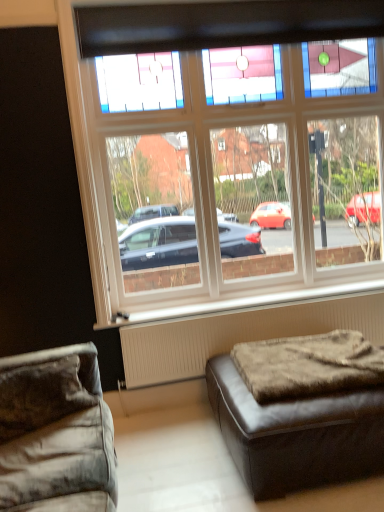
In order to face white textured radiator at lower right, should I rotate leftwards or rightwards?

Rotate your view right by about 9.620°.

This screenshot has width=384, height=512. What are the coordinates of `velvet fabric studio couch at lower left, which is the second studio couch from right to left` in the screenshot? It's located at (56, 433).

What is the approximate width of velvet fabric studio couch at lower left, which is the 1th studio couch in left-to-right order?

26.71 inches.

What do you see at coordinates (223, 170) in the screenshot?
I see `clear glass window at upper center` at bounding box center [223, 170].

Describe the element at coordinates (300, 410) in the screenshot. I see `brown leather ottoman at lower right, the 2th studio couch in the left-to-right sequence` at that location.

The image size is (384, 512). I want to click on brown fuzzy ottoman at lower right, so click(308, 365).

Which of these two, brown fuzzy ottoman at lower right or brown leather ottoman at lower right, which ranks as the first studio couch in right-to-left order, is smaller?

With smaller size is brown fuzzy ottoman at lower right.

Is brown fuzzy ottoman at lower right positioned beyond the bounds of brown leather ottoman at lower right, the 2th studio couch in the left-to-right sequence?

Indeed, brown fuzzy ottoman at lower right is completely outside brown leather ottoman at lower right, the 2th studio couch in the left-to-right sequence.

Is brown fuzzy ottoman at lower right taller or shorter than brown leather ottoman at lower right, the 2th studio couch in the left-to-right sequence?

brown fuzzy ottoman at lower right is shorter than brown leather ottoman at lower right, the 2th studio couch in the left-to-right sequence.

Can you confirm if brown fuzzy ottoman at lower right is positioned to the left of brown leather ottoman at lower right, which ranks as the first studio couch in right-to-left order?

Correct, you'll find brown fuzzy ottoman at lower right to the left of brown leather ottoman at lower right, which ranks as the first studio couch in right-to-left order.

Considering their positions, is clear glass window at upper center located in front of or behind white textured radiator at lower right?

clear glass window at upper center is positioned closer to the viewer than white textured radiator at lower right.

Between clear glass window at upper center and white textured radiator at lower right, which one has smaller size?

white textured radiator at lower right.

Locate an element on the screen. The width and height of the screenshot is (384, 512). window located in front of the white textured radiator at lower right is located at coordinates (223, 170).

Is clear glass window at upper center next to white textured radiator at lower right?

No, clear glass window at upper center is not making contact with white textured radiator at lower right.

Between brown leather ottoman at lower right, which ranks as the first studio couch in right-to-left order, and white textured radiator at lower right, which one has larger size?

brown leather ottoman at lower right, which ranks as the first studio couch in right-to-left order, is bigger.

Is brown leather ottoman at lower right, the 2th studio couch in the left-to-right sequence, at the right side of white textured radiator at lower right?

Indeed, brown leather ottoman at lower right, the 2th studio couch in the left-to-right sequence, is positioned on the right side of white textured radiator at lower right.

Does brown leather ottoman at lower right, which ranks as the first studio couch in right-to-left order, have a greater height compared to white textured radiator at lower right?

No, brown leather ottoman at lower right, which ranks as the first studio couch in right-to-left order, is not taller than white textured radiator at lower right.

Which object is closer to the camera, brown leather ottoman at lower right, the 2th studio couch in the left-to-right sequence, or white textured radiator at lower right?

Positioned in front is brown leather ottoman at lower right, the 2th studio couch in the left-to-right sequence.

Is white textured radiator at lower right touching clear glass window at upper center?

white textured radiator at lower right and clear glass window at upper center are not in contact.

Consider the image. How far apart are white textured radiator at lower right and clear glass window at upper center?

They are 74.78 centimeters apart.

Is white textured radiator at lower right smaller than clear glass window at upper center?

Yes, white textured radiator at lower right is smaller than clear glass window at upper center.

Does white textured radiator at lower right have a lesser height compared to clear glass window at upper center?

Yes, white textured radiator at lower right is shorter than clear glass window at upper center.

Which is in front, velvet fabric studio couch at lower left, which is the 1th studio couch in left-to-right order, or white textured radiator at lower right?

velvet fabric studio couch at lower left, which is the 1th studio couch in left-to-right order, is more forward.

How much distance is there between velvet fabric studio couch at lower left, which is the second studio couch from right to left, and white textured radiator at lower right?

38.16 inches.

From a real-world perspective, is velvet fabric studio couch at lower left, which is the second studio couch from right to left, physically located above or below white textured radiator at lower right?

velvet fabric studio couch at lower left, which is the second studio couch from right to left, is above white textured radiator at lower right.

Are brown leather ottoman at lower right, which ranks as the first studio couch in right-to-left order, and velvet fabric studio couch at lower left, which is the second studio couch from right to left, located far from each other?

→ brown leather ottoman at lower right, which ranks as the first studio couch in right-to-left order, is actually quite close to velvet fabric studio couch at lower left, which is the second studio couch from right to left.

Considering the sizes of objects brown leather ottoman at lower right, which ranks as the first studio couch in right-to-left order, and velvet fabric studio couch at lower left, which is the second studio couch from right to left, in the image provided, who is shorter, brown leather ottoman at lower right, which ranks as the first studio couch in right-to-left order, or velvet fabric studio couch at lower left, which is the second studio couch from right to left,?

brown leather ottoman at lower right, which ranks as the first studio couch in right-to-left order.

Image resolution: width=384 pixels, height=512 pixels. Identify the location of studio couch below the brown leather ottoman at lower right, the 2th studio couch in the left-to-right sequence (from the image's perspective). (56, 433).

Is brown leather ottoman at lower right, which ranks as the first studio couch in right-to-left order, bigger than velvet fabric studio couch at lower left, which is the 1th studio couch in left-to-right order?

Actually, brown leather ottoman at lower right, which ranks as the first studio couch in right-to-left order, might be smaller than velvet fabric studio couch at lower left, which is the 1th studio couch in left-to-right order.

From a real-world perspective, which object stands above the other?

brown fuzzy ottoman at lower right is physically above.

Is velvet fabric studio couch at lower left, which is the second studio couch from right to left, surrounding brown fuzzy ottoman at lower right?

No, velvet fabric studio couch at lower left, which is the second studio couch from right to left, does not contain brown fuzzy ottoman at lower right.

From the image's perspective, is velvet fabric studio couch at lower left, which is the 1th studio couch in left-to-right order, located above or below brown fuzzy ottoman at lower right?

From the image's perspective, velvet fabric studio couch at lower left, which is the 1th studio couch in left-to-right order, appears below brown fuzzy ottoman at lower right.

Which is in front, point (74, 487) or point (242, 355)?

Point (74, 487)

The width and height of the screenshot is (384, 512). Identify the location of the 1st studio couch positioned below the brown fuzzy ottoman at lower right (from the image's perspective). (300, 410).

Identify the location of window above the white textured radiator at lower right (from the image's perspective). (223, 170).

Which object lies further to the anchor point brown fuzzy ottoman at lower right, brown leather ottoman at lower right, which ranks as the first studio couch in right-to-left order, or white textured radiator at lower right?

Among the two, white textured radiator at lower right is located further to brown fuzzy ottoman at lower right.

Based on their spatial positions, is brown fuzzy ottoman at lower right or velvet fabric studio couch at lower left, which is the second studio couch from right to left, further from brown leather ottoman at lower right, the 2th studio couch in the left-to-right sequence?

Among the two, velvet fabric studio couch at lower left, which is the second studio couch from right to left, is located further to brown leather ottoman at lower right, the 2th studio couch in the left-to-right sequence.

Looking at the image, which one is located closer to white textured radiator at lower right, clear glass window at upper center or brown fuzzy ottoman at lower right?

Among the two, brown fuzzy ottoman at lower right is located nearer to white textured radiator at lower right.

Estimate the real-world distances between objects in this image. Which object is closer to velvet fabric studio couch at lower left, which is the second studio couch from right to left, clear glass window at upper center or brown fuzzy ottoman at lower right?

brown fuzzy ottoman at lower right.

Which object lies nearer to the anchor point brown fuzzy ottoman at lower right, velvet fabric studio couch at lower left, which is the 1th studio couch in left-to-right order, or clear glass window at upper center?

velvet fabric studio couch at lower left, which is the 1th studio couch in left-to-right order, is closer to brown fuzzy ottoman at lower right.

Based on their spatial positions, is velvet fabric studio couch at lower left, which is the 1th studio couch in left-to-right order, or brown fuzzy ottoman at lower right closer to white textured radiator at lower right?

Based on the image, brown fuzzy ottoman at lower right appears to be nearer to white textured radiator at lower right.

When comparing their distances from clear glass window at upper center, does brown fuzzy ottoman at lower right or velvet fabric studio couch at lower left, which is the 1th studio couch in left-to-right order, seem further?

The object further to clear glass window at upper center is velvet fabric studio couch at lower left, which is the 1th studio couch in left-to-right order.

From the image, which object appears to be nearer to clear glass window at upper center, white textured radiator at lower right or velvet fabric studio couch at lower left, which is the 1th studio couch in left-to-right order?

white textured radiator at lower right is closer to clear glass window at upper center.

What are the coordinates of `mattress between clear glass window at upper center and brown leather ottoman at lower right, which ranks as the first studio couch in right-to-left order, in the up-down direction` in the screenshot? It's located at (308, 365).

Where is `studio couch positioned between velvet fabric studio couch at lower left, which is the 1th studio couch in left-to-right order, and clear glass window at upper center from near to far`? This screenshot has height=512, width=384. studio couch positioned between velvet fabric studio couch at lower left, which is the 1th studio couch in left-to-right order, and clear glass window at upper center from near to far is located at coordinates (300, 410).

Where is `studio couch between velvet fabric studio couch at lower left, which is the 1th studio couch in left-to-right order, and white textured radiator at lower right in the front-back direction`? This screenshot has width=384, height=512. studio couch between velvet fabric studio couch at lower left, which is the 1th studio couch in left-to-right order, and white textured radiator at lower right in the front-back direction is located at coordinates (300, 410).

Where is `mattress between velvet fabric studio couch at lower left, which is the 1th studio couch in left-to-right order, and clear glass window at upper center in the front-back direction`? mattress between velvet fabric studio couch at lower left, which is the 1th studio couch in left-to-right order, and clear glass window at upper center in the front-back direction is located at coordinates (308, 365).